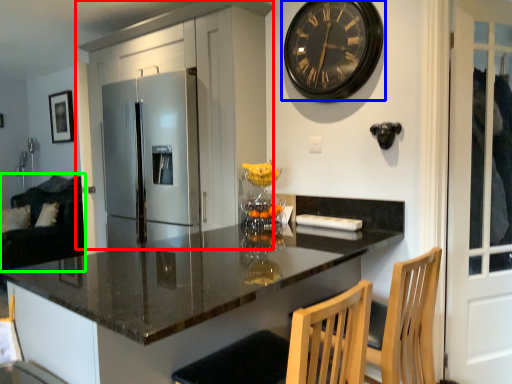
Question: Considering the real-world distances, which object is closest to cabinetry (highlighted by a red box)? wall clock (highlighted by a blue box) or couch (highlighted by a green box).

Choices:
 (A) wall clock
 (B) couch

Answer: (A)